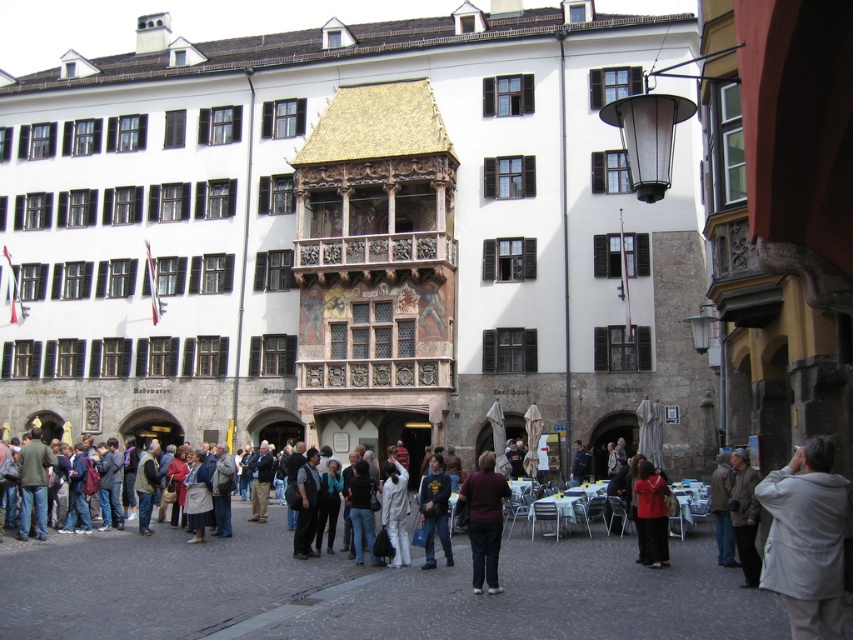
Consider the image. Between light gray fabric jacket at lower right and white matte jacket at center, which one has less height?

With less height is white matte jacket at center.

Which of these two, light gray fabric jacket at lower right or white matte jacket at center, stands taller?

light gray fabric jacket at lower right is taller.

Describe the element at coordinates (805, 540) in the screenshot. I see `light gray fabric jacket at lower right` at that location.

Find the location of `light gray fabric jacket at lower right`. light gray fabric jacket at lower right is located at coordinates (805, 540).

Identify the location of dark brown fabric pants at center. This screenshot has width=853, height=640. (485, 518).

Which is above, dark brown fabric pants at center or red matte jacket at lower center?

Positioned higher is dark brown fabric pants at center.

Does point (482, 541) come behind point (639, 557)?

No, it is in front of (639, 557).

At what (x,y) coordinates should I click in order to perform the action: click on dark brown fabric pants at center. Please return your answer as a coordinate pair (x, y). Looking at the image, I should click on (485, 518).

Can you confirm if dark blue cotton shirt at center is thinner than white matte jacket at center?

No, dark blue cotton shirt at center is not thinner than white matte jacket at center.

Find the location of a particular element. dark blue cotton shirt at center is located at coordinates (434, 509).

Does point (442, 468) come behind point (396, 500)?

Yes, it is behind point (396, 500).

Find the location of a particular element. dark blue cotton shirt at center is located at coordinates (434, 509).